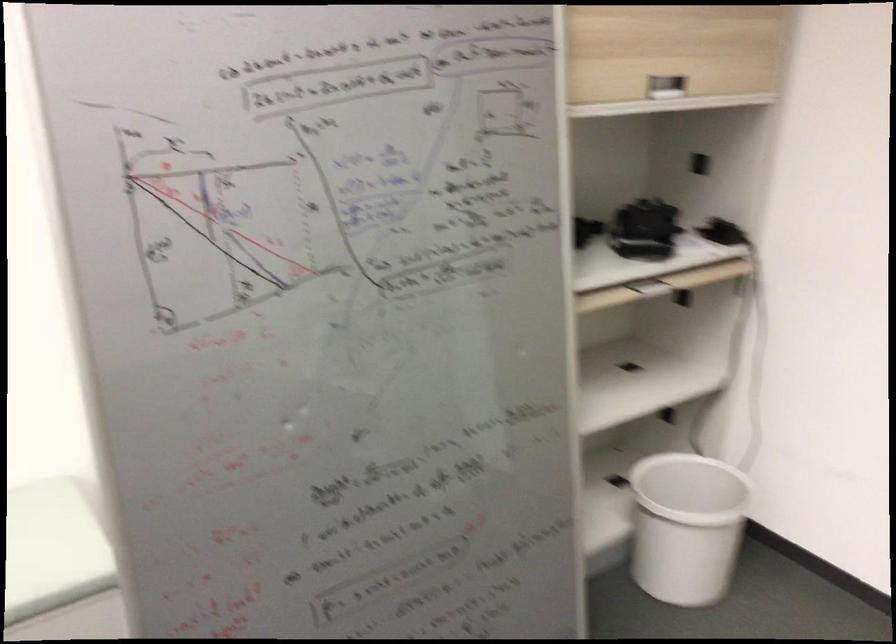
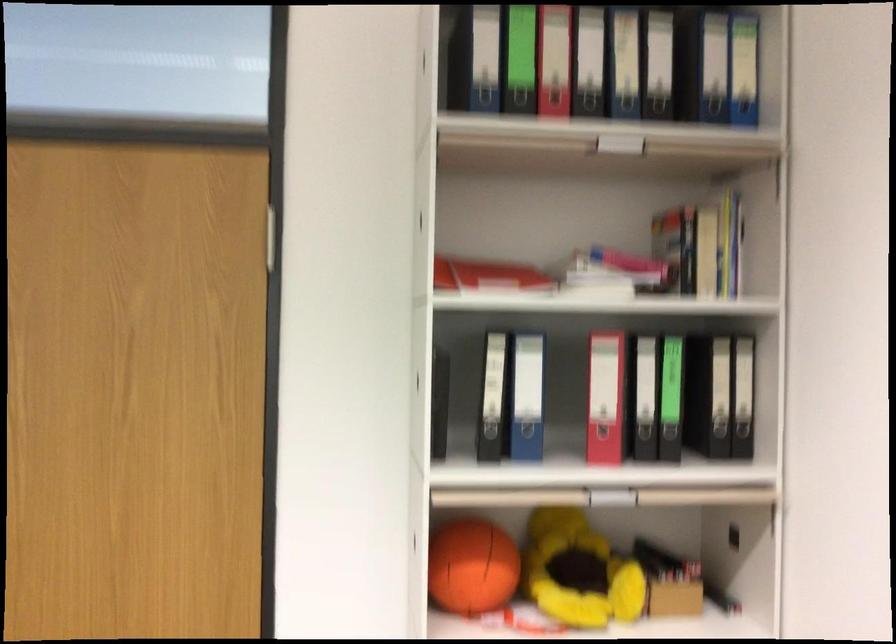
Question: The camera is either moving clockwise (left) or counter-clockwise (right) around the object. The first image is from the beginning of the video and the second image is from the end. Is the camera moving left or right when shooting the video?

Choices:
 (A) Left
 (B) Right

Answer: (A)